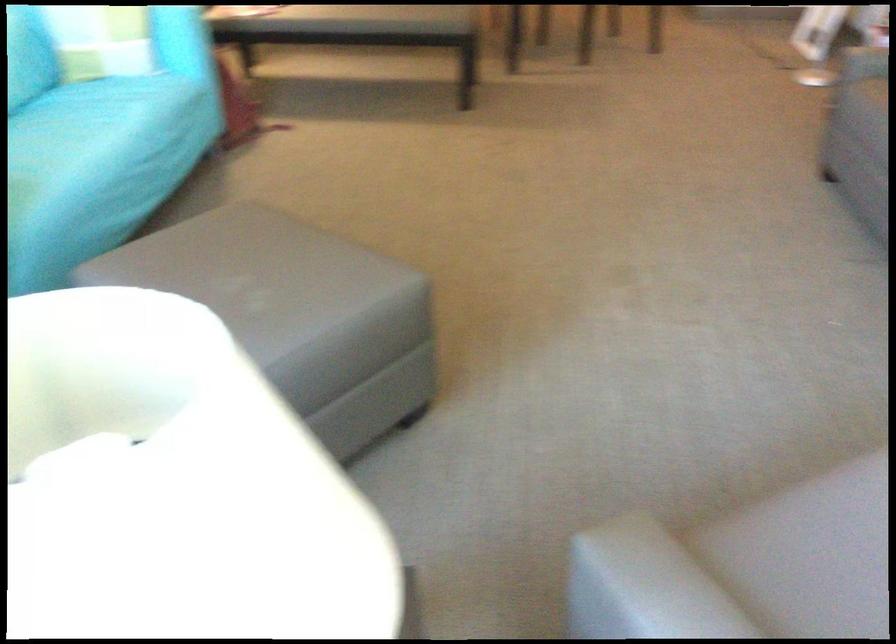
Where is `gray sofa armrest`? The height and width of the screenshot is (644, 896). gray sofa armrest is located at coordinates (665, 583).